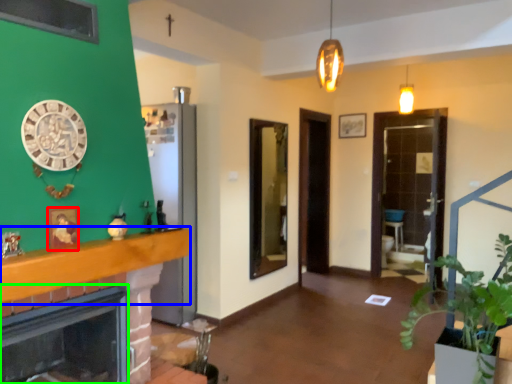
Question: Which is nearer to the picture frame (highlighted by a red box)? balustrade (highlighted by a blue box) or fireplace (highlighted by a green box).

Choices:
 (A) balustrade
 (B) fireplace

Answer: (A)